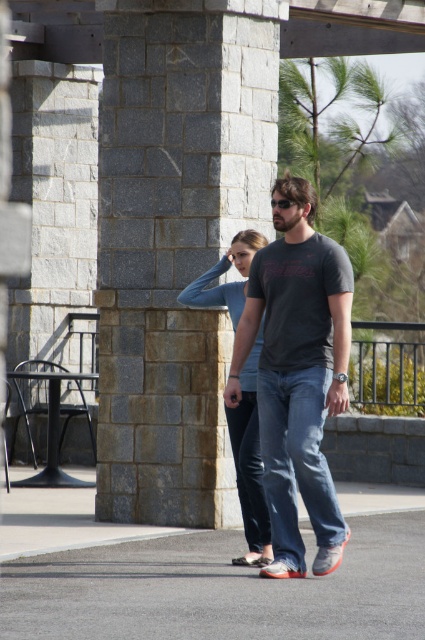
You are a photographer trying to capture a candid shot of the light blue denim jeans at center without including the gray asphalt at lower center in the frame. Based on their positions, is this possible?

The gray asphalt at lower center is in front of the light blue denim jeans at center, so the asphalt would block the view of the jeans. Therefore, it is not possible to capture the light blue denim jeans at center without including the gray asphalt at lower center in the frame.